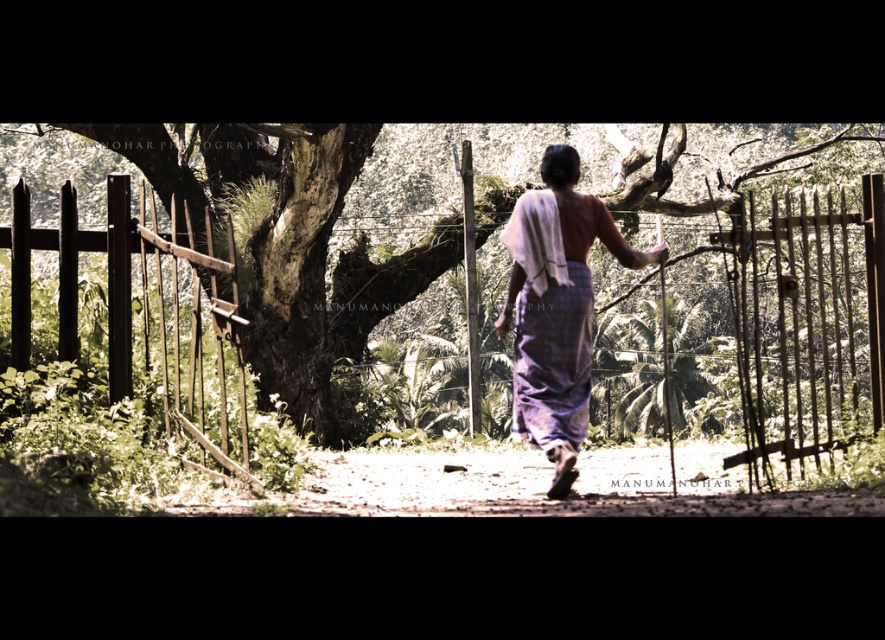
Question: From the image, what is the correct spatial relationship of smooth bark tree at center in relation to dark brown wooden fence at left?

Choices:
 (A) right
 (B) left

Answer: (A)

Question: Can you confirm if smooth bark tree at center is positioned below dark brown wooden fence at left?

Choices:
 (A) yes
 (B) no

Answer: (B)

Question: Which point appears closest to the camera in this image?

Choices:
 (A) coord(526,346)
 (B) coord(259,490)
 (C) coord(19,349)
 (D) coord(871,508)

Answer: (D)

Question: Which object is positioned closest to the dark brown wooden fence at left?

Choices:
 (A) dirt ground at center
 (B) smooth bark tree at center
 (C) purple checkered dress at center

Answer: (A)

Question: Can you confirm if dark brown wooden fence at left is bigger than purple checkered dress at center?

Choices:
 (A) yes
 (B) no

Answer: (A)

Question: Which of these objects is positioned closest to the dirt ground at center?

Choices:
 (A) smooth bark tree at center
 (B) dark brown wooden fence at left

Answer: (B)